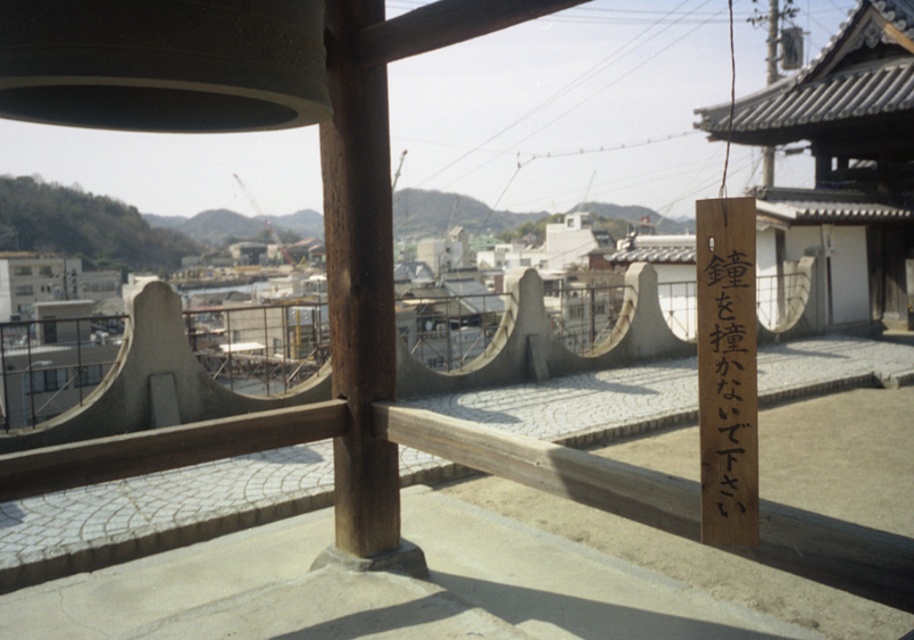
You are a tour guide leading a group of visitors to the entrance of the temple. You need to guide them from the smooth brown wooden post at center to the black wood sign at center right. Is there enough space for a visitor who uses a wheelchair with a width of 0.8 meters to maneuver between these two objects?

The distance between the smooth brown wooden post at center and the black wood sign at center right is 1.96 meters. Since the wheelchair is 0.8 meters wide, there is sufficient space for the visitor to maneuver between them as the distance is greater than the wheelchair width.

You are a carpenter tasked with creating a replica of the black wood sign at center right. You have a piece of wood that is exactly the same width as the smooth brown wooden post at center. Will this piece of wood be wide enough for the sign?

The smooth brown wooden post at center might be wider than black wood sign at center right. Therefore, the piece of wood that matches the post width could be sufficient, but there is uncertainty since the comparison is not definitive.